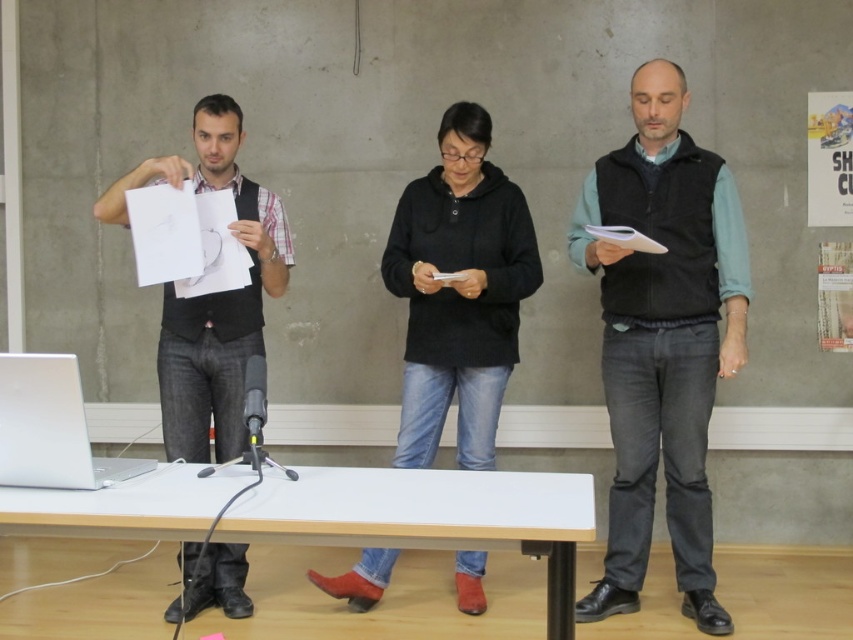
Between point (698, 572) and point (456, 502), which one is positioned behind?

The point (698, 572) is behind.

Which of these two, dark gray vest at center or white wood table at lower center, stands taller?

Standing taller between the two is dark gray vest at center.

Locate an element on the screen. The width and height of the screenshot is (853, 640). dark gray vest at center is located at coordinates (662, 339).

You are a GUI agent. You are given a task and a screenshot of the screen. Output one action in this format:
    pyautogui.click(x=<x>, y=<y>)
    Task: Click on the dark gray vest at center
    
    Given the screenshot: What is the action you would take?
    pyautogui.click(x=662, y=339)

Who is more distant from viewer, (196, 522) or (508, 328)?

Positioned behind is point (508, 328).

Who is more distant from viewer, (428, 524) or (461, 243)?

The point (461, 243) is more distant.

Where is `white wood table at lower center`? This screenshot has width=853, height=640. white wood table at lower center is located at coordinates (428, 516).

Is black matte jacket at center positioned before silver metallic laptop at lower left?

No, it is behind silver metallic laptop at lower left.

What do you see at coordinates (457, 291) in the screenshot?
I see `black matte jacket at center` at bounding box center [457, 291].

Which is behind, point (320, 579) or point (90, 484)?

The point (320, 579) is behind.

Find the location of a particular element. black matte jacket at center is located at coordinates [457, 291].